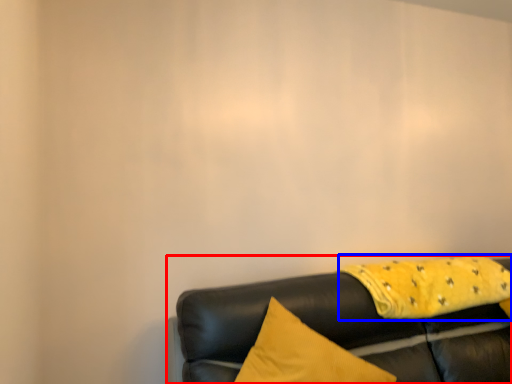
Question: Which of the following is the closest to the observer, studio couch (highlighted by a red box) or blanket (highlighted by a blue box)?

Choices:
 (A) studio couch
 (B) blanket

Answer: (A)